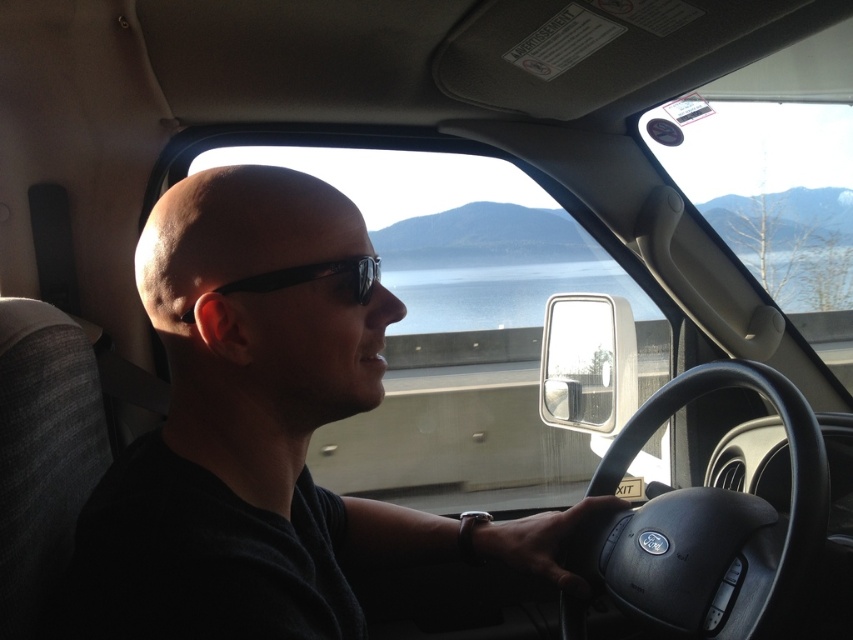
Does black matte shirt at center have a greater height compared to black matte steering wheel at center?

Yes, black matte shirt at center is taller than black matte steering wheel at center.

Who is more distant from viewer, (326,588) or (699,570)?

Point (699,570)

Identify the location of black matte shirt at center. (264, 432).

How much distance is there between black matte shirt at center and black plastic sunglasses at center?

They are 8.59 inches apart.

How far apart are black matte shirt at center and black plastic sunglasses at center?

8.59 inches

The image size is (853, 640). Identify the location of black matte shirt at center. (264, 432).

Which of these two, black matte steering wheel at center or black plastic sunglasses at center, stands taller?

Standing taller between the two is black matte steering wheel at center.

Which is above, black matte steering wheel at center or black plastic sunglasses at center?

black plastic sunglasses at center is above.

Is point (712, 545) in front of point (250, 282)?

No, it is not.

Locate an element on the screen. black matte steering wheel at center is located at coordinates (714, 524).